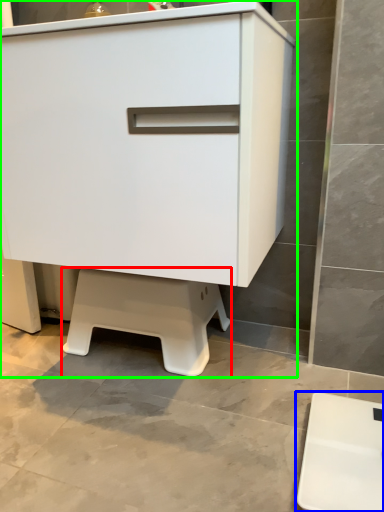
Question: Which object is positioned farthest from step stool (highlighted by a red box)? Select from furniture (highlighted by a blue box) and chest of drawers (highlighted by a green box).

Choices:
 (A) furniture
 (B) chest of drawers

Answer: (A)